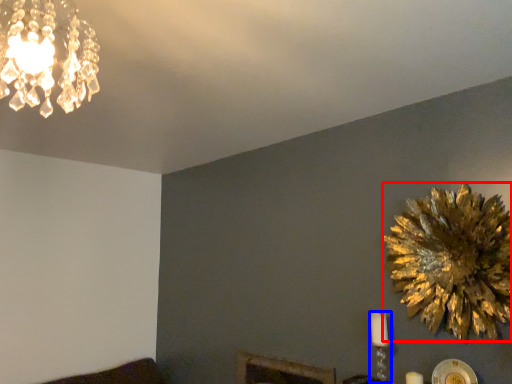
Question: Which point is closer to the camera, flower (highlighted by a red box) or candle holder (highlighted by a blue box)?

Choices:
 (A) flower
 (B) candle holder

Answer: (A)